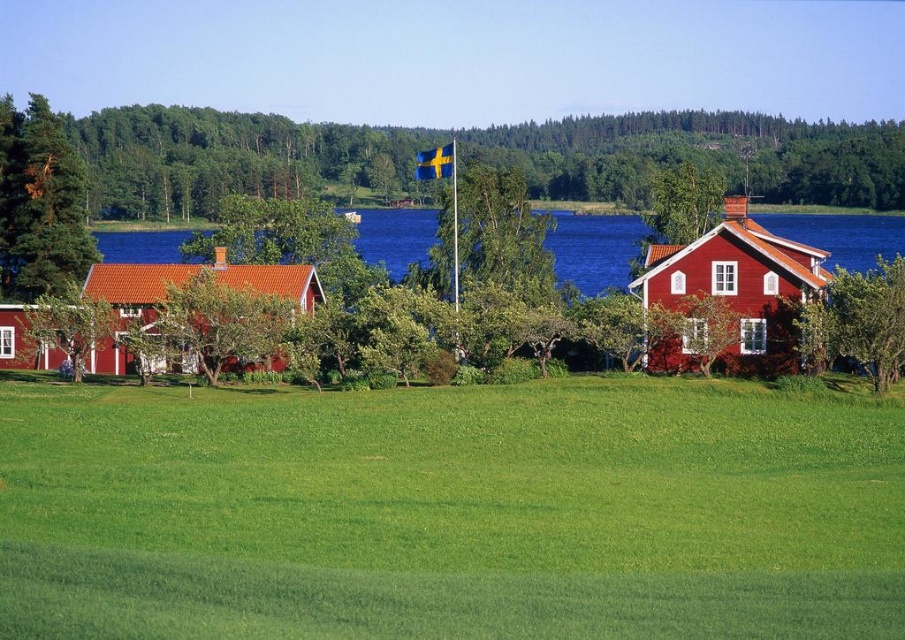
Question: In this image, where is green leafy tree at center-right located relative to green leafy tree at lower left?

Choices:
 (A) right
 (B) left

Answer: (A)

Question: Which of the following is the closest to the observer?

Choices:
 (A) (68, 346)
 (B) (148, 525)
 (C) (849, 332)
 (D) (53, 177)

Answer: (B)

Question: Can you confirm if green pine tree at left is positioned above green leafy tree at center-right?

Choices:
 (A) yes
 (B) no

Answer: (A)

Question: Which object appears closest to the camera in this image?

Choices:
 (A) green leafy tree at center-right
 (B) green leafy tree at center
 (C) green grassy field at lower center
 (D) green leafy tree at upper left

Answer: (C)

Question: Is green leafy tree at center-right behind green leafy tree at lower left?

Choices:
 (A) yes
 (B) no

Answer: (B)

Question: Which object is the farthest from the green pine tree at left?

Choices:
 (A) green leafy tree at upper left
 (B) green leafy tree at center-right

Answer: (A)